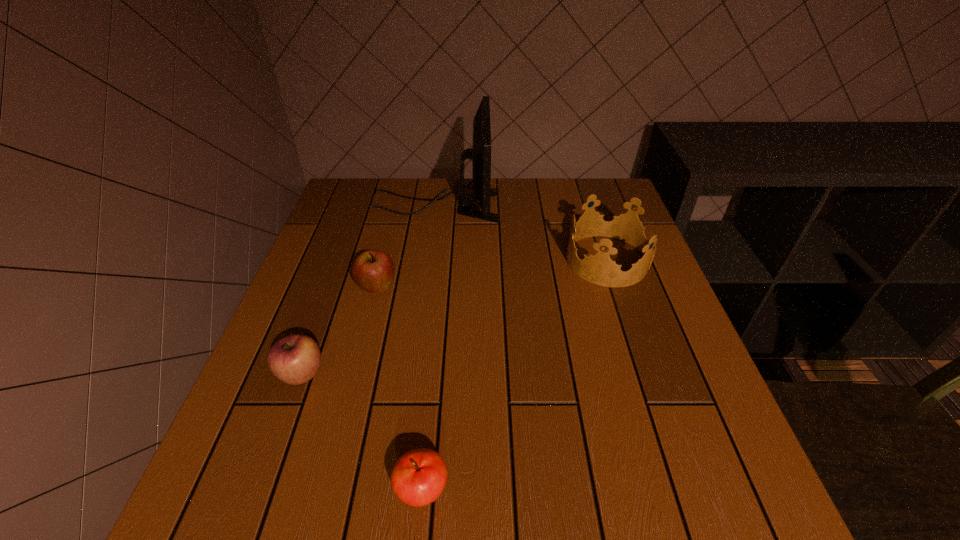
I want to click on free spot between the shortest object and the farthest apple, so click(399, 389).

Locate an element on the screen. The height and width of the screenshot is (540, 960). free area in between the farthest apple and the leftmost apple is located at coordinates (340, 332).

Locate an element on the screen. The height and width of the screenshot is (540, 960). empty space that is in between the tiara and the shortest apple is located at coordinates (515, 375).

Identify the location of the third closest object to the farthest apple. The image size is (960, 540). (418, 478).

Identify which object is the third closest to the rightmost apple. Please provide its 2D coordinates. Your answer should be formatted as a tuple, i.e. [(x, y)], where the tuple contains the x and y coordinates of a point satisfying the conditions above.

[(599, 269)]

Image resolution: width=960 pixels, height=540 pixels. Find the location of `apple that stands as the second closest to the second nearest object`. apple that stands as the second closest to the second nearest object is located at coordinates [418, 478].

Identify the location of apple that is the closest one to the fourth farthest object. The height and width of the screenshot is (540, 960). (373, 270).

The image size is (960, 540). What are the coordinates of `vacant space that satisfies the following two spatial constraints: 1. on the front side of the farthest apple; 2. on the right side of the nearest apple` in the screenshot? It's located at (327, 490).

Identify the location of vacant space that satisfies the following two spatial constraints: 1. on the back side of the shortest object; 2. on the screen side of the computer monitor. [449, 206].

Locate an element on the screen. free point that satisfies the following two spatial constraints: 1. on the back side of the rightmost apple; 2. on the screen side of the tallest object is located at coordinates (449, 206).